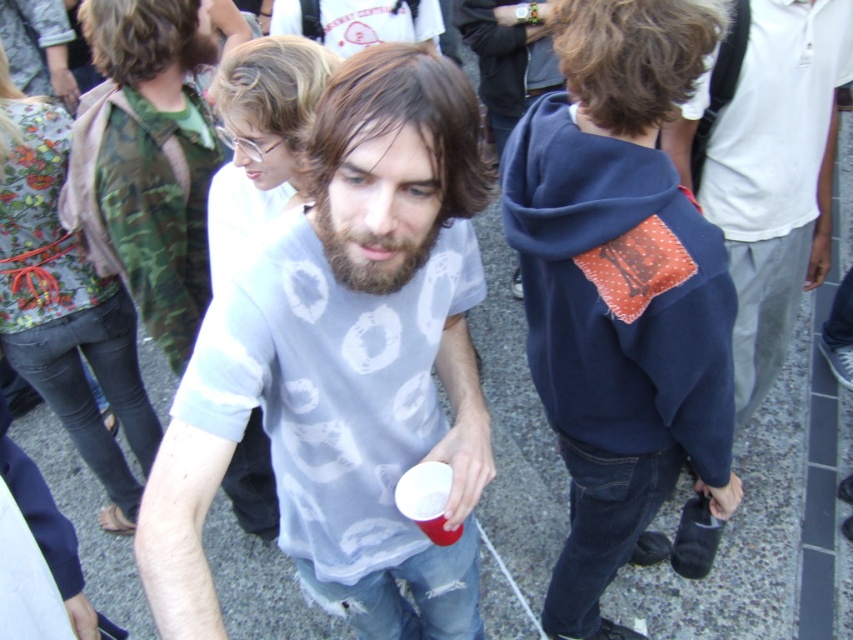
Does blondehair at upper left have a lesser width compared to beardsoft hairat center?

In fact, blondehair at upper left might be wider than beardsoft hairat center.

Can you confirm if blondehair at upper left is positioned below beardsoft hairat center?

Incorrect, blondehair at upper left is not positioned below beardsoft hairat center.

Who is more distant from viewer, (289, 77) or (401, 212)?

The point (289, 77) is more distant.

You are a GUI agent. You are given a task and a screenshot of the screen. Output one action in this format:
    pyautogui.click(x=<x>, y=<y>)
    Task: Click on the blondehair at upper left
    The height and width of the screenshot is (640, 853).
    Given the screenshot: What is the action you would take?
    pyautogui.click(x=273, y=84)

Image resolution: width=853 pixels, height=640 pixels. Describe the element at coordinates (776, 177) in the screenshot. I see `white cotton shirt at upper center` at that location.

Does point (804, 240) lie in front of point (660, 67)?

No, it is behind (660, 67).

Identify the location of white cotton shirt at upper center. This screenshot has width=853, height=640. (776, 177).

Does brown fuzzy hair at upper right have a lesser height compared to beardsoft hairat center?

No.

Is brown fuzzy hair at upper right further to the viewer compared to beardsoft hairat center?

Yes, brown fuzzy hair at upper right is further from the viewer.

I want to click on brown fuzzy hair at upper right, so click(633, 56).